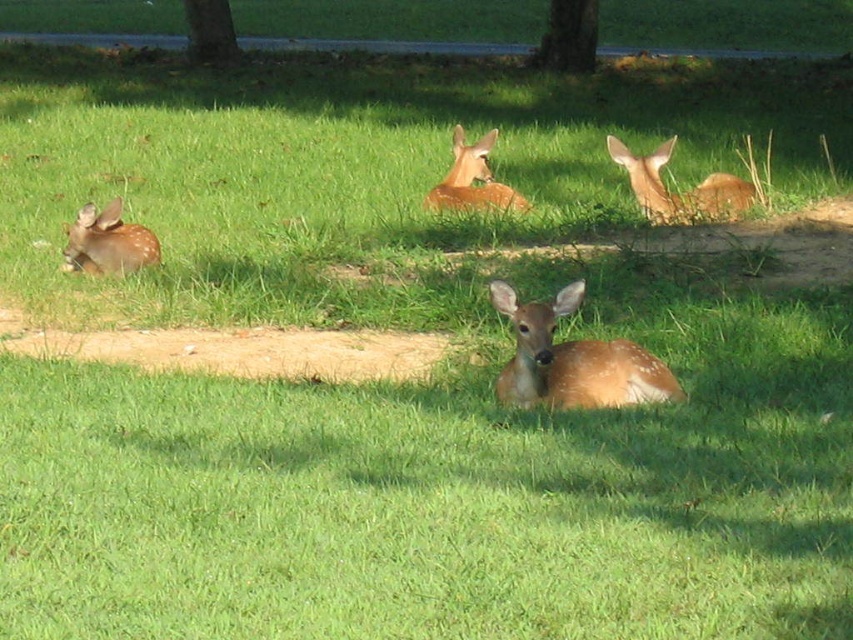
Does brown speckled fur at center have a lesser width compared to green rough bark tree at upper center?

In fact, brown speckled fur at center might be wider than green rough bark tree at upper center.

Who is more distant from viewer, (488, 186) or (529, 60)?

The point (529, 60) is more distant.

This screenshot has width=853, height=640. Identify the location of brown speckled fur at center. (473, 179).

Can you confirm if fawn fur deer at center is positioned above green rough bark tree at upper center?

Actually, fawn fur deer at center is below green rough bark tree at upper center.

Is fawn fur deer at center below green rough bark tree at upper center?

Yes.

Is point (590, 401) less distant than point (585, 40)?

Yes, point (590, 401) is closer to viewer.

Locate an element on the screen. fawn fur deer at center is located at coordinates (573, 360).

Is point (460, 134) positioned before point (187, 26)?

That is True.

Who is taller, brown speckled fur at center or green textured tree at upper center?

green textured tree at upper center

Locate an element on the screen. Image resolution: width=853 pixels, height=640 pixels. brown speckled fur at center is located at coordinates (473, 179).

You are a GUI agent. You are given a task and a screenshot of the screen. Output one action in this format:
    pyautogui.click(x=<x>, y=<y>)
    Task: Click on the brown speckled fur at center
    The image size is (853, 640).
    Given the screenshot: What is the action you would take?
    pyautogui.click(x=473, y=179)